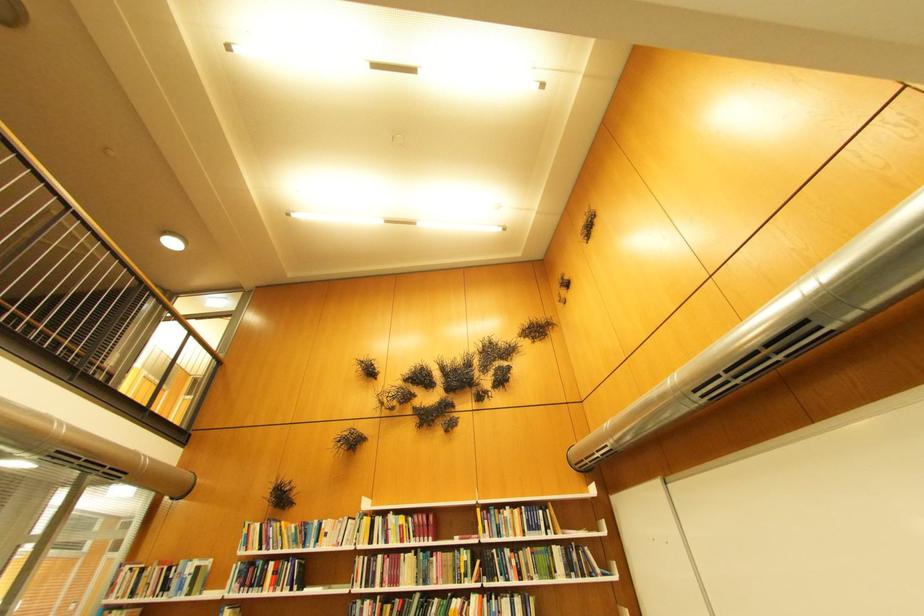
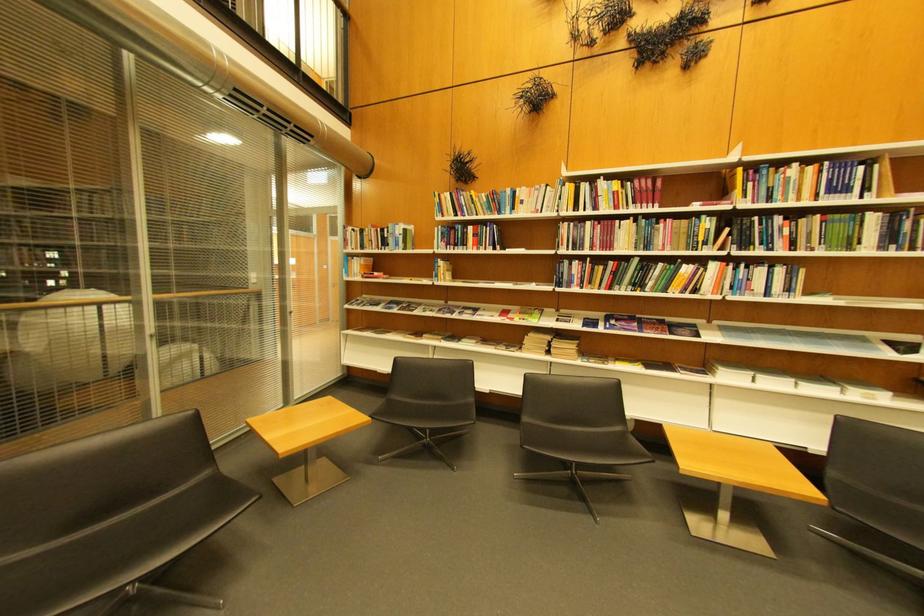
In the second image, find the point that corresponds to [502,578] in the first image.

(756, 246)